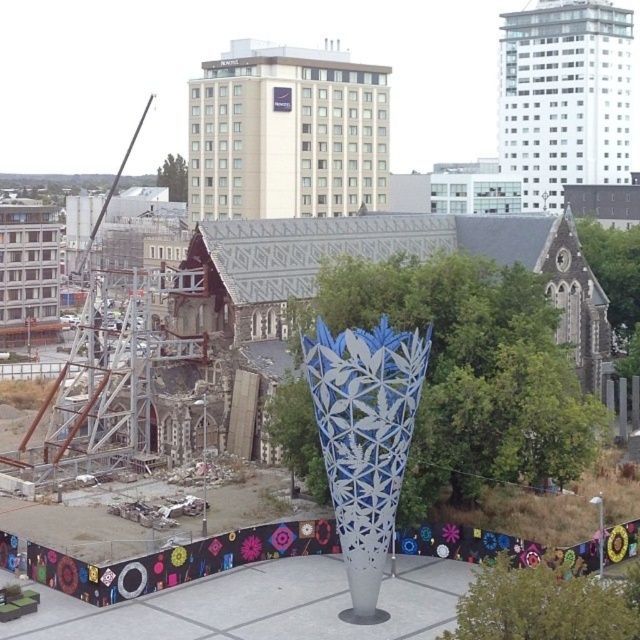
You are a city planner who needs to plant a new tree in the urban landscape. The green leafy tree at center is currently in place. If you want to plant another tree 60 meters away from it, will there be enough space between them according to the existing layout?

The existing green leafy tree at center and the new tree would need to be 60 meters apart. Since the current distance between them is 60.30 meters, there is sufficient space, so yes, planting the new tree 60 meters away is feasible.

You are a city planner analyzing the urban layout. Given the green leafy tree at center is positioned at coordinates 0.583, 0.734, how would you describe its placement relative to the central axis of the paved area?

The green leafy tree at center is positioned at coordinates (468, 372), which places it slightly to the right and above the central axis of the paved area.